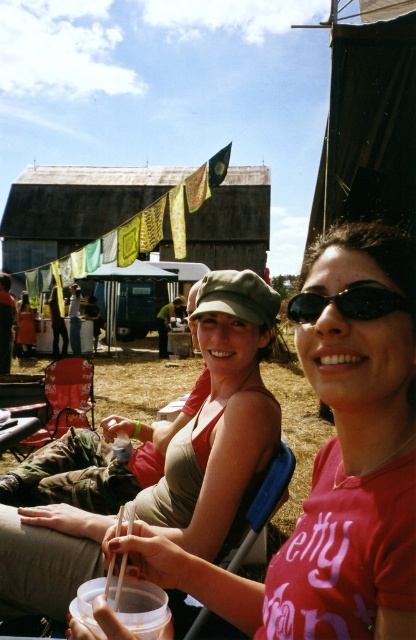
Question: Which point appears closest to the camera in this image?

Choices:
 (A) (250, 378)
 (B) (381, 300)

Answer: (B)

Question: Among these points, which one is farthest from the camera?

Choices:
 (A) (61, 518)
 (B) (354, 467)
 (C) (364, 296)

Answer: (A)

Question: Is matte khaki cap at center bigger than black plastic sunglasses at center?

Choices:
 (A) yes
 (B) no

Answer: (A)

Question: Which point is closer to the camera?

Choices:
 (A) black plastic sunglasses at center
 (B) matte green cap at center
 (C) matte khaki cap at center

Answer: (B)

Question: Can you confirm if matte green cap at center is thinner than matte khaki cap at center?

Choices:
 (A) yes
 (B) no

Answer: (A)

Question: Does matte green cap at center have a greater width compared to matte khaki cap at center?

Choices:
 (A) yes
 (B) no

Answer: (B)